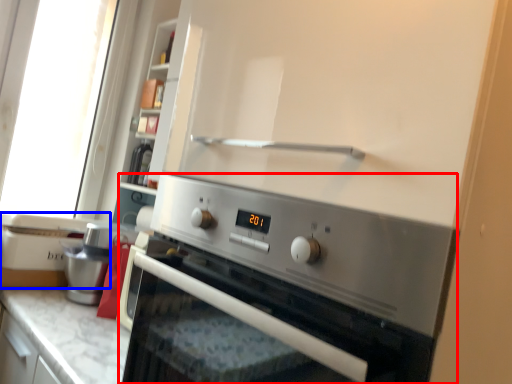
Question: Which point is further to the camera, home appliance (highlighted by a red box) or appliance (highlighted by a blue box)?

Choices:
 (A) home appliance
 (B) appliance

Answer: (B)